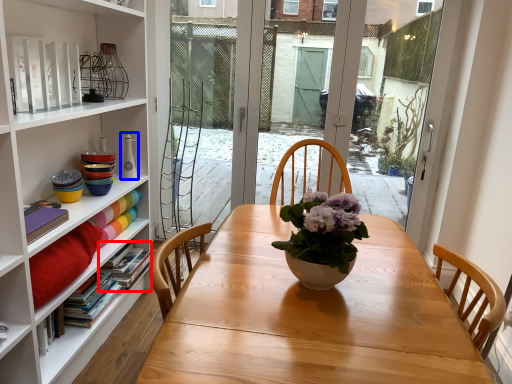
Question: Which object appears farthest to the camera in this image, book (highlighted by a red box) or vase (highlighted by a blue box)?

Choices:
 (A) book
 (B) vase

Answer: (B)